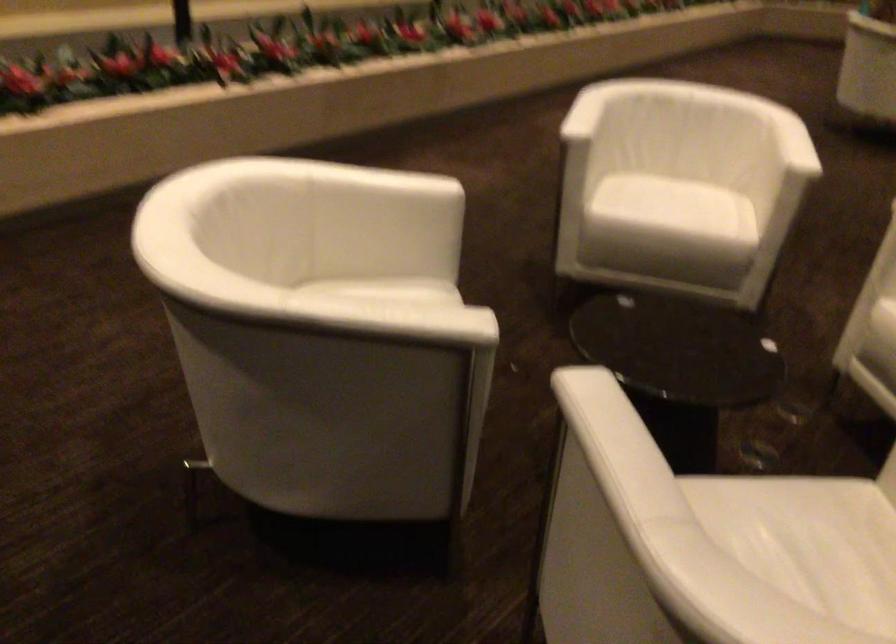
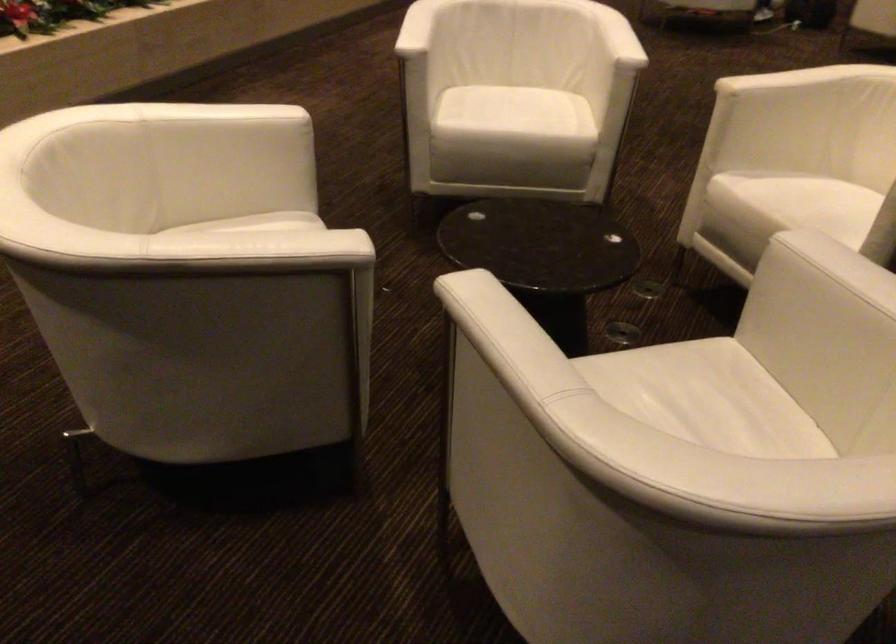
Question: Which direction would the cameraman need to move to produce the second image? Reply with the corresponding letter.

Choices:
 (A) Left
 (B) Right
 (C) Forward
 (D) Backward

Answer: (A)